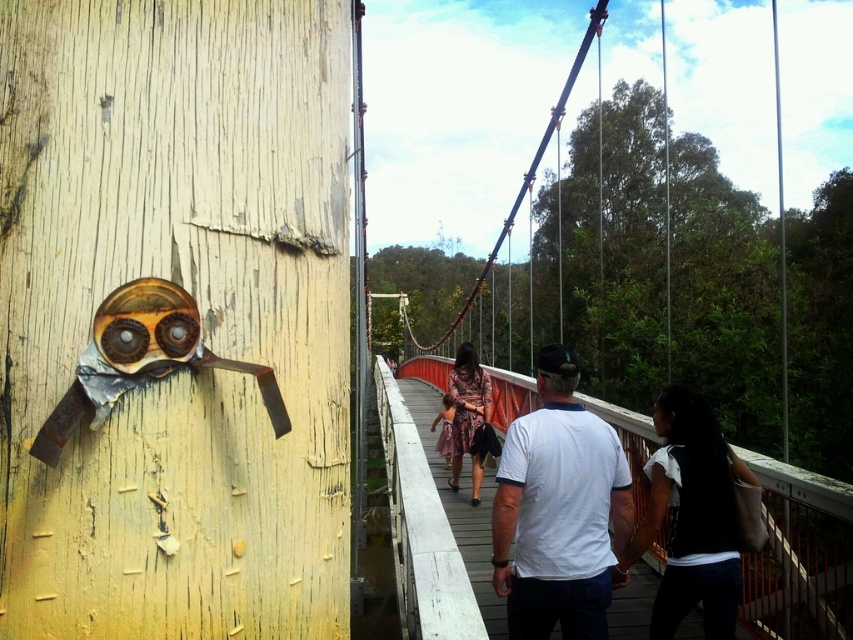
You are standing at the point labeled as point (560, 512) on the wooden suspension bridge. Which object is located exactly at this coordinate?

The point (560, 512) indicates the white cotton shirt at center.

You are a photographer standing on the wooden suspension bridge. You see a person wearing a white cotton shirt at center and another person wearing a floral dress at center. Which clothing item is covering the other?

The white cotton shirt at center is positioned over the floral dress at center, so it is covering the floral dress at center.

You are a photographer standing on the wooden suspension bridge. You see a person wearing a white cotton shirt at center and another wearing a floral dress at center. Which clothing item is taller?

The white cotton shirt at center is much taller as the floral dress at center.